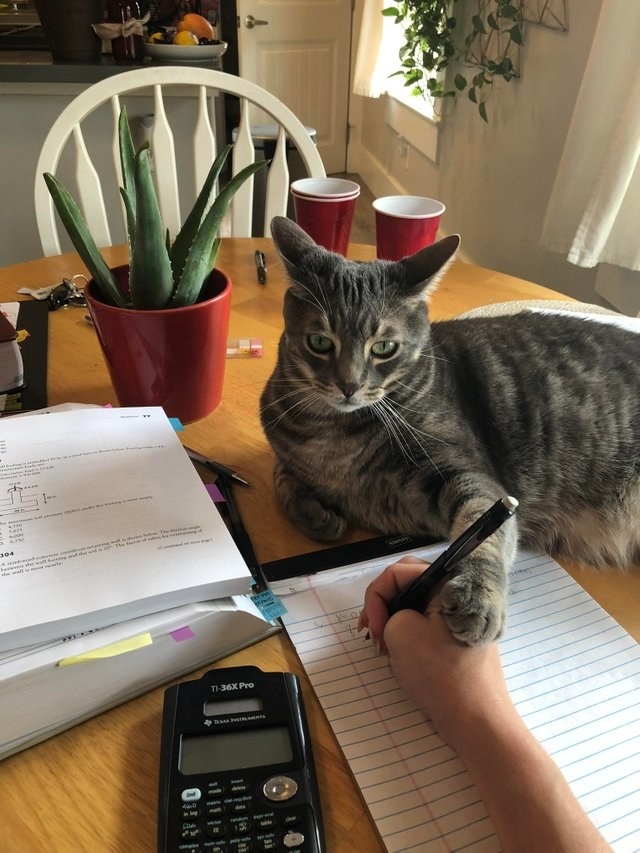
The image size is (640, 853). I want to click on chair, so pos(198,154).